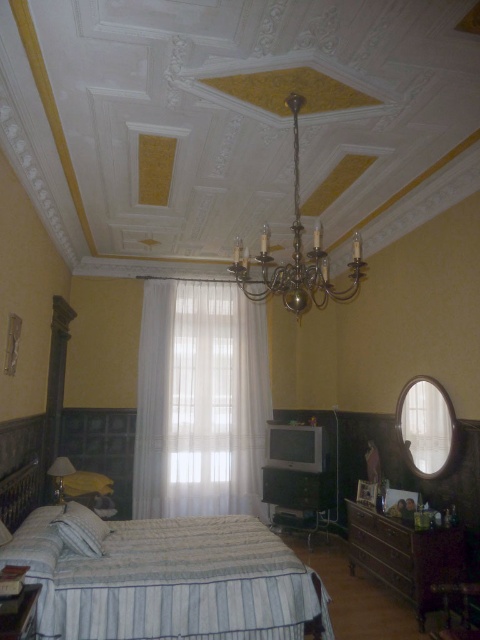
You are standing at the entrance of the traditional bedroom and want to walk directly to the white striped bed at center. Given that the room is 5 meters long from the entrance to the bed, and you are 1.7 meters tall, will you be able to walk to the bed without hitting your head on the ceiling? Please explain your reasoning.

The height of the ceiling in the bedroom is not provided in the scene description, so it is impossible to determine if you will hit your head. The position coordinates of the white striped bed at center only indicate its location in the room, not the ceiling height.

You are standing in the bedroom and want to reach the wooden dresser at lower right. Is the sheer white curtain at center blocking your path to it?

The wooden dresser at lower right is behind the sheer white curtain at center, so the curtain is blocking your path to the dresser.

You are an interior designer planning to replace the wooden dresser at lower right and the gold polished chandelier at upper center with new items. If you want to keep the scale of the room balanced, which object should you choose a larger version of?

The wooden dresser at lower right should be kept larger because it is already bigger than the gold polished chandelier at upper center, so maintaining its size helps preserve the room balance.